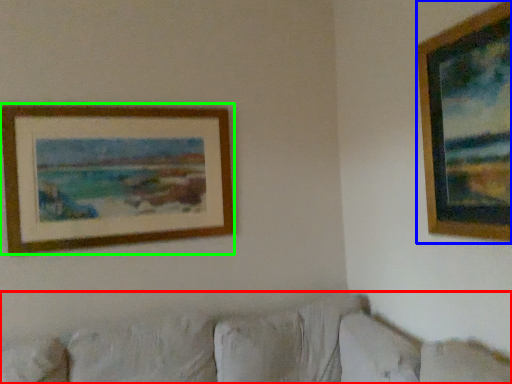
Question: Which object is positioned closest to couch (highlighted by a red box)? Select from picture frame (highlighted by a blue box) and picture frame (highlighted by a green box).

Choices:
 (A) picture frame
 (B) picture frame

Answer: (B)